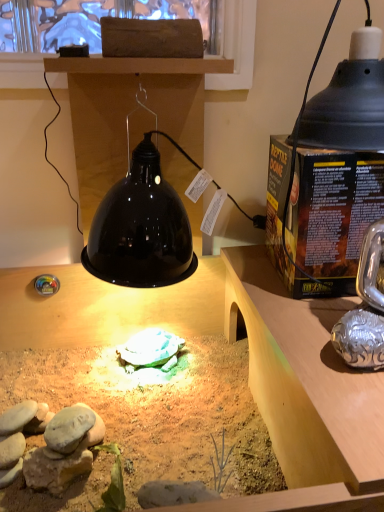
Question: Is wooden desk at center oriented towards black matte lampshade at upper right?

Choices:
 (A) no
 (B) yes

Answer: (A)

Question: Is wooden desk at center positioned behind black matte lampshade at upper right?

Choices:
 (A) no
 (B) yes

Answer: (A)

Question: From the image's perspective, is wooden desk at center under black matte lampshade at upper right?

Choices:
 (A) no
 (B) yes

Answer: (B)

Question: Can you confirm if wooden desk at center is thinner than black matte lampshade at upper right?

Choices:
 (A) yes
 (B) no

Answer: (B)

Question: From a real-world perspective, is wooden desk at center positioned over black matte lampshade at upper right based on gravity?

Choices:
 (A) yes
 (B) no

Answer: (B)

Question: From a real-world perspective, is wooden desk at center beneath black matte lampshade at upper right?

Choices:
 (A) no
 (B) yes

Answer: (B)

Question: Would you say black matte lampshade at upper right is outside wooden desk at center?

Choices:
 (A) yes
 (B) no

Answer: (A)

Question: From a real-world perspective, is black matte lampshade at upper right positioned over wooden desk at center based on gravity?

Choices:
 (A) yes
 (B) no

Answer: (A)

Question: Does black matte lampshade at upper right have a lesser width compared to wooden desk at center?

Choices:
 (A) no
 (B) yes

Answer: (B)

Question: Is black matte lampshade at upper right closer to camera compared to wooden desk at center?

Choices:
 (A) no
 (B) yes

Answer: (A)

Question: From a real-world perspective, is black matte lampshade at upper right below wooden desk at center?

Choices:
 (A) yes
 (B) no

Answer: (B)

Question: Can you confirm if black matte lampshade at upper right is bigger than wooden desk at center?

Choices:
 (A) no
 (B) yes

Answer: (A)

Question: Considering their positions, is black matte lampshade at upper right located in front of or behind wooden desk at center?

Choices:
 (A) behind
 (B) front

Answer: (A)